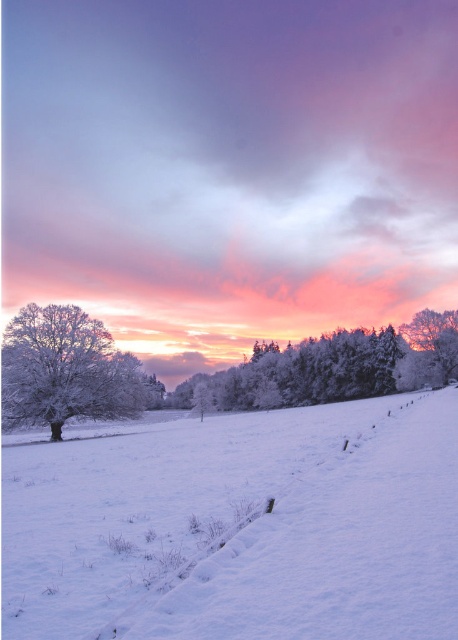
Question: Which object is positioned closest to the white frosty tree at left?

Choices:
 (A) frosted glass trees at center
 (B) white frosty snow at center

Answer: (B)

Question: Does white frosty snow at center have a larger size compared to white frosty tree at left?

Choices:
 (A) no
 (B) yes

Answer: (B)

Question: Is frosted glass trees at center smaller than white frosty tree at left?

Choices:
 (A) yes
 (B) no

Answer: (B)

Question: Is white frosty snow at center to the right of frosted glass trees at center from the viewer's perspective?

Choices:
 (A) no
 (B) yes

Answer: (A)

Question: Based on their relative distances, which object is nearer to the white frosty tree at left?

Choices:
 (A) white frosty snow at center
 (B) frosted glass trees at center

Answer: (A)

Question: Which point is closer to the camera taking this photo?

Choices:
 (A) (190, 470)
 (B) (32, 404)

Answer: (A)